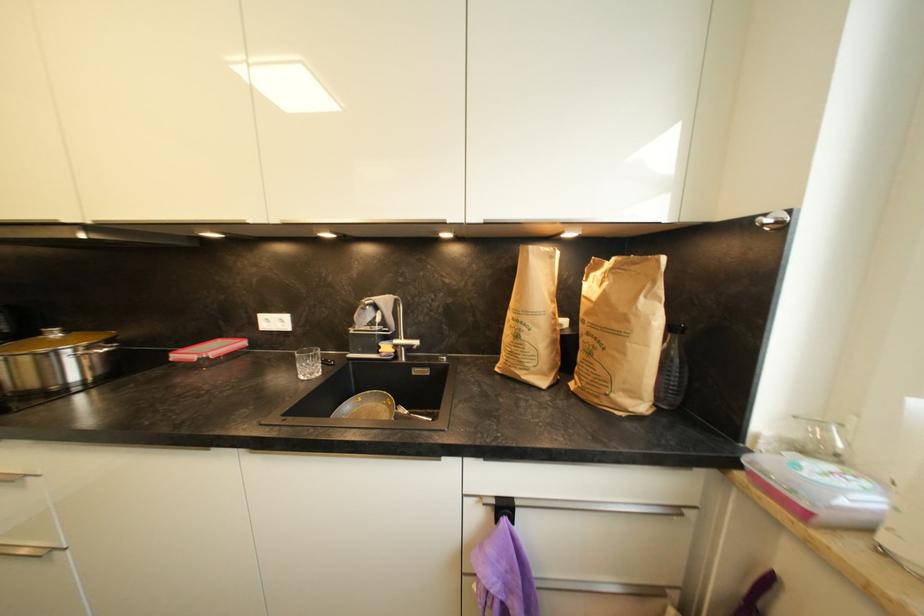
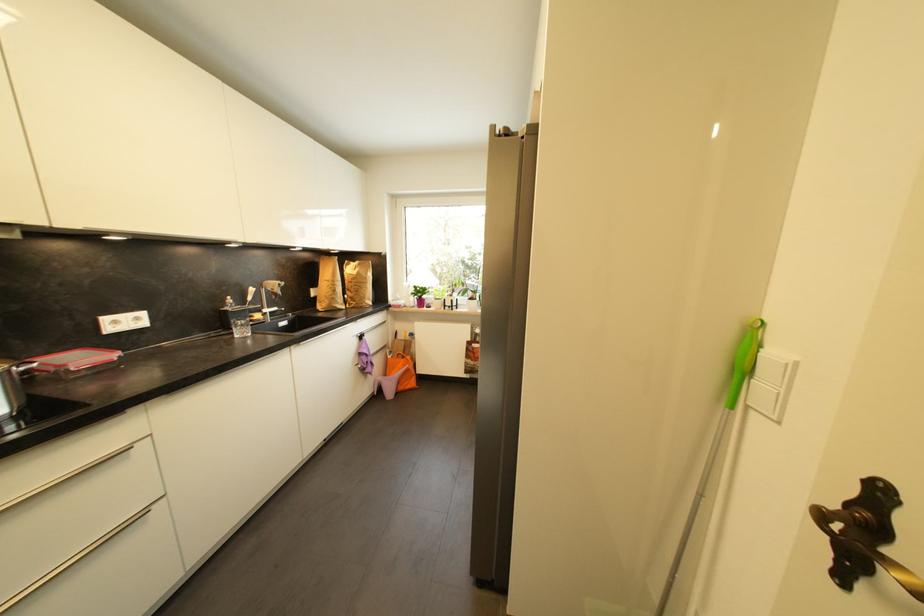
Locate, in the second image, the point that corresponds to [521,338] in the first image.

(339, 293)